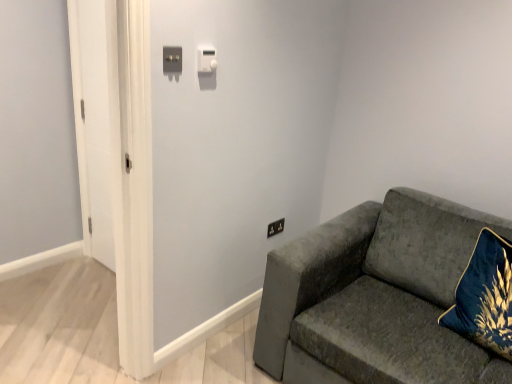
Question: Is white glossy door at left shorter than satin silver switch at upper center, which is the 1th light switch from front to back?

Choices:
 (A) no
 (B) yes

Answer: (A)

Question: Is white glossy door at left far away from satin silver switch at upper center, which is the 1th light switch from front to back?

Choices:
 (A) no
 (B) yes

Answer: (B)

Question: Is white glossy door at left taller than satin silver switch at upper center, the 1th light switch positioned from the left?

Choices:
 (A) yes
 (B) no

Answer: (A)

Question: Considering the relative sizes of white glossy door at left and satin silver switch at upper center, which is the 1th light switch from front to back, in the image provided, is white glossy door at left smaller than satin silver switch at upper center, which is the 1th light switch from front to back,?

Choices:
 (A) yes
 (B) no

Answer: (B)

Question: Is white glossy door at left with satin silver switch at upper center, the 1th light switch positioned from the left?

Choices:
 (A) no
 (B) yes

Answer: (A)

Question: Considering the positions of white glossy door at left and satin silver switch at upper center, the 1th light switch positioned from the left, in the image, is white glossy door at left wider or thinner than satin silver switch at upper center, the 1th light switch positioned from the left,?

Choices:
 (A) thin
 (B) wide

Answer: (B)

Question: Is white glossy door at left inside the boundaries of satin silver switch at upper center, the 1th light switch positioned from the left, or outside?

Choices:
 (A) inside
 (B) outside

Answer: (B)

Question: Considering the positions of point (94, 87) and point (178, 51), is point (94, 87) closer or farther from the camera than point (178, 51)?

Choices:
 (A) farther
 (B) closer

Answer: (A)

Question: Visually, is white glossy door at left positioned to the left or to the right of satin silver switch at upper center, the 1th light switch positioned from the left?

Choices:
 (A) left
 (B) right

Answer: (A)

Question: Considering the positions of point (77, 79) and point (448, 297), is point (77, 79) closer or farther from the camera than point (448, 297)?

Choices:
 (A) closer
 (B) farther

Answer: (B)

Question: Would you say white glossy door at left is to the left or to the right of velvet gray couch at right in the picture?

Choices:
 (A) right
 (B) left

Answer: (B)

Question: In terms of height, does white glossy door at left look taller or shorter compared to velvet gray couch at right?

Choices:
 (A) tall
 (B) short

Answer: (A)

Question: Is white glossy door at left bigger or smaller than velvet gray couch at right?

Choices:
 (A) small
 (B) big

Answer: (A)

Question: Is satin silver switch at upper center, which is the 1th light switch from front to back, spatially inside white plastic light switch at upper center, which appears as the first light switch when viewed from the right, or outside of it?

Choices:
 (A) inside
 (B) outside

Answer: (B)

Question: Considering the positions of satin silver switch at upper center, which is the 1th light switch from front to back, and white plastic light switch at upper center, placed as the 2th light switch when sorted from left to right, in the image, is satin silver switch at upper center, which is the 1th light switch from front to back, bigger or smaller than white plastic light switch at upper center, placed as the 2th light switch when sorted from left to right,?

Choices:
 (A) big
 (B) small

Answer: (B)